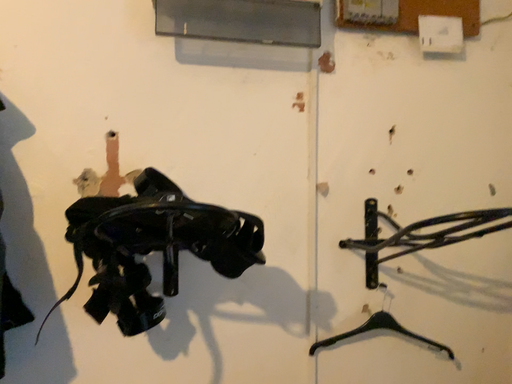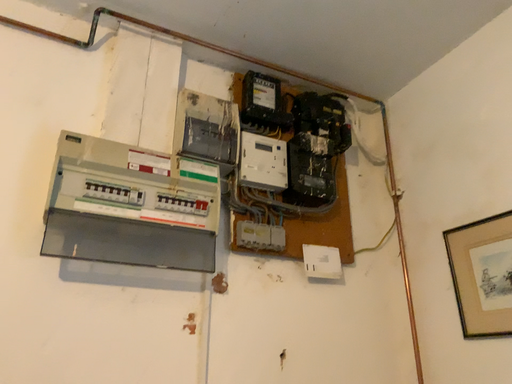
Question: Which way did the camera rotate in the video?

Choices:
 (A) rotated right
 (B) rotated left

Answer: (A)